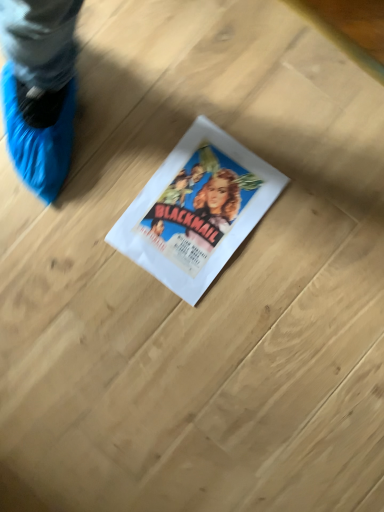
Find the location of a particular element. This screenshot has width=384, height=512. white paper at center is located at coordinates (196, 210).

In order to face white paper at center, should I rotate leftwards or rightwards?

A 0.682 degree turn to the right will do.

What do you see at coordinates (196, 210) in the screenshot?
I see `white paper at center` at bounding box center [196, 210].

Where is `white paper at center`? white paper at center is located at coordinates (196, 210).